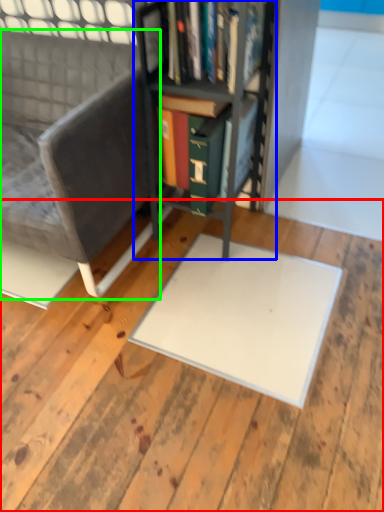
Question: Considering the real-world distances, which object is closest to plywood (highlighted by a red box)? bookcase (highlighted by a blue box) or chair (highlighted by a green box).

Choices:
 (A) bookcase
 (B) chair

Answer: (B)